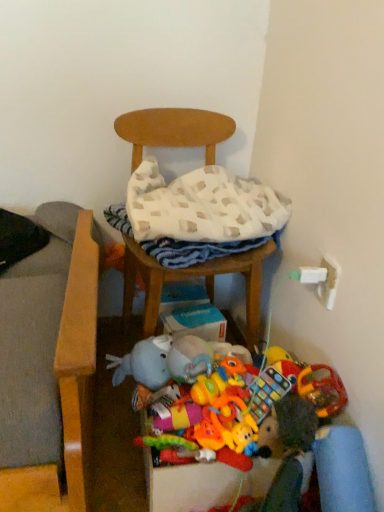
Question: Is there a large distance between wooden chair at center and white woven blanket at center?

Choices:
 (A) yes
 (B) no

Answer: (B)

Question: Is wooden chair at center shorter than white woven blanket at center?

Choices:
 (A) no
 (B) yes

Answer: (A)

Question: From the image's perspective, is wooden chair at center located beneath white woven blanket at center?

Choices:
 (A) yes
 (B) no

Answer: (A)

Question: Does wooden chair at center have a greater width compared to white woven blanket at center?

Choices:
 (A) yes
 (B) no

Answer: (A)

Question: Does wooden chair at center have a lesser width compared to white woven blanket at center?

Choices:
 (A) yes
 (B) no

Answer: (B)

Question: Is white woven blanket at center inside the boundaries of wooden chair at center, or outside?

Choices:
 (A) inside
 (B) outside

Answer: (A)

Question: Considering the positions of white woven blanket at center and wooden chair at center in the image, is white woven blanket at center wider or thinner than wooden chair at center?

Choices:
 (A) wide
 (B) thin

Answer: (B)

Question: Considering their positions, is white woven blanket at center located in front of or behind wooden chair at center?

Choices:
 (A) front
 (B) behind

Answer: (B)

Question: Is white woven blanket at center taller or shorter than wooden chair at center?

Choices:
 (A) tall
 (B) short

Answer: (B)

Question: From the image's perspective, is wooden chair at center positioned above or below knitted fabric rattle at center, which is counted as the second toy, starting from the right?

Choices:
 (A) above
 (B) below

Answer: (A)

Question: From a real-world perspective, is wooden chair at center above or below knitted fabric rattle at center, which is counted as the second toy, starting from the right?

Choices:
 (A) above
 (B) below

Answer: (A)

Question: Is wooden chair at center taller or shorter than knitted fabric rattle at center, which is counted as the second toy, starting from the right?

Choices:
 (A) short
 (B) tall

Answer: (B)

Question: In terms of width, does wooden chair at center look wider or thinner when compared to knitted fabric rattle at center, which is counted as the second toy, starting from the right?

Choices:
 (A) wide
 (B) thin

Answer: (A)

Question: Looking at the image, does rubberized plastic toy at lower center, the 2th toy in the left-to-right sequence, seem bigger or smaller compared to knitted fabric rattle at center, which is the first toy in left-to-right order?

Choices:
 (A) small
 (B) big

Answer: (B)

Question: Is point (256, 412) closer or farther from the camera than point (155, 402)?

Choices:
 (A) farther
 (B) closer

Answer: (B)